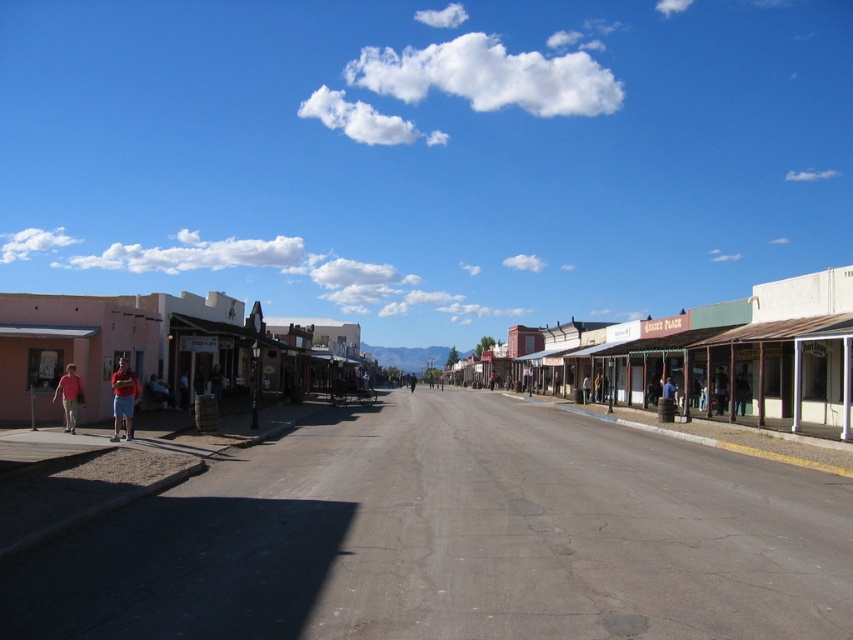
Question: Is matte pink building at left behind denim pants at center?

Choices:
 (A) yes
 (B) no

Answer: (B)

Question: Does denim jacket at center come behind matte blue jeans at left?

Choices:
 (A) no
 (B) yes

Answer: (B)

Question: Does matte red shorts at left appear over brown leather jacket at center?

Choices:
 (A) no
 (B) yes

Answer: (B)

Question: Which point is farther to the camera?

Choices:
 (A) denim jacket at center
 (B) brown leather jacket at center

Answer: (B)

Question: Among these objects, which one is nearest to the camera?

Choices:
 (A) blue denim jeans at center
 (B) matte blue jeans at left

Answer: (B)

Question: Which object appears farthest from the camera in this image?

Choices:
 (A) white wooden building at center
 (B) denim pants at center
 (C) matte blue jeans at center
 (D) matte blue jeans at left

Answer: (C)